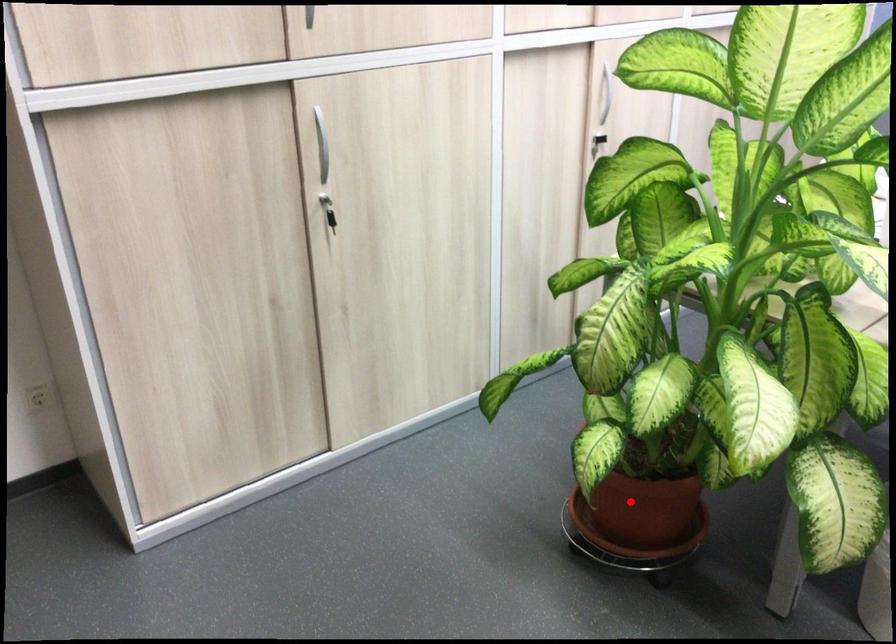
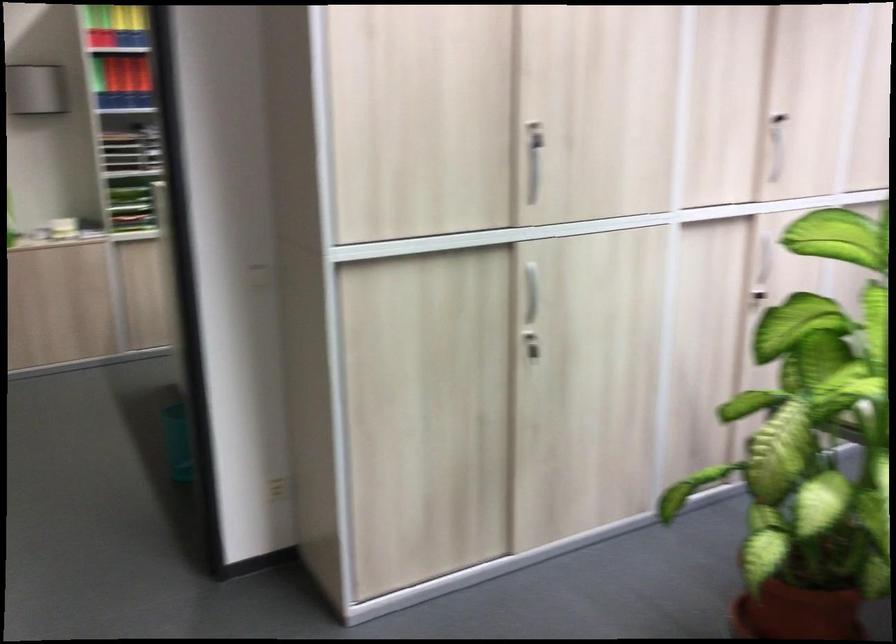
In the second image, find the point that corresponds to the highlighted location in the first image.

(797, 612)